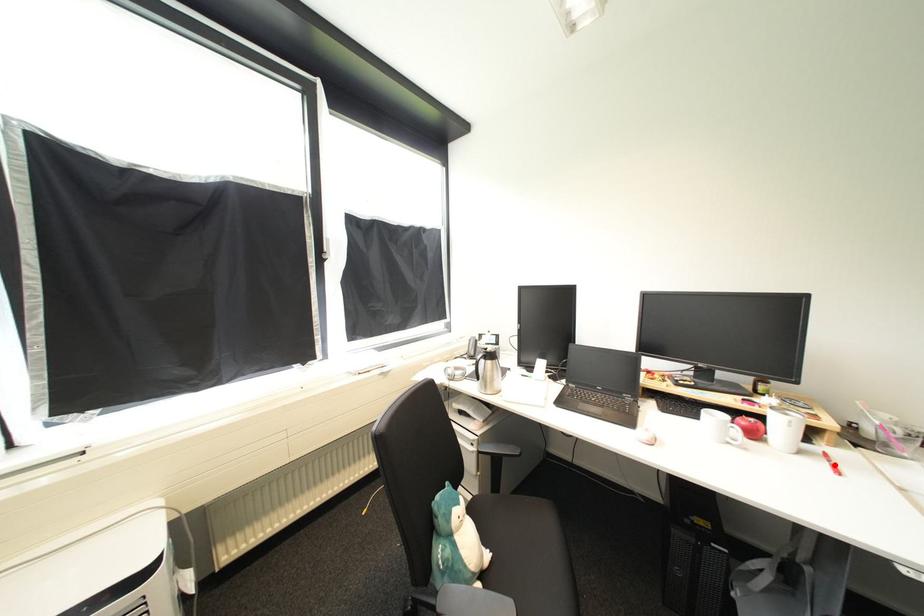
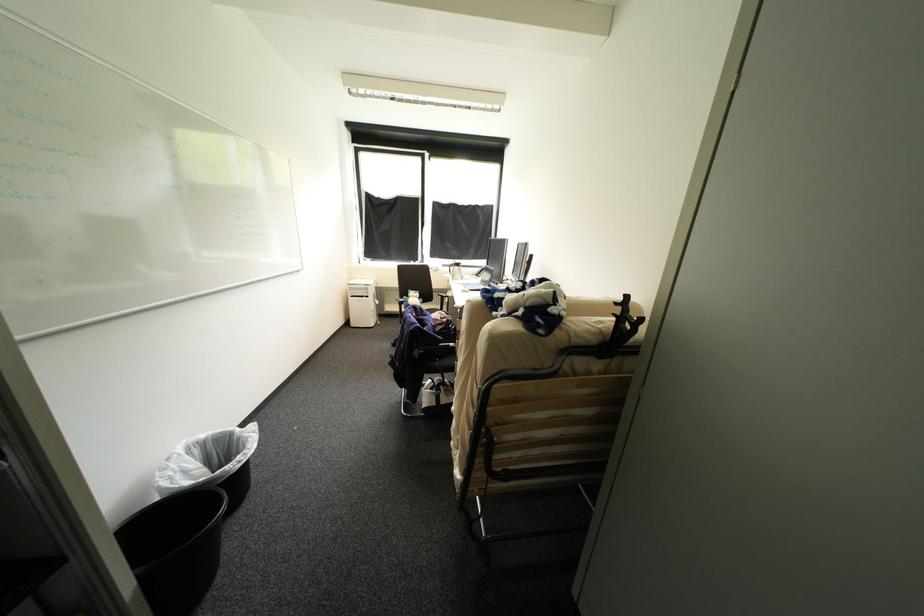
Question: I am providing you with two images of the same scene from different viewpoints. A red point is marked on the first image. At the location where the point appears in image 1, is it still visible in image 2?

Choices:
 (A) Yes
 (B) No

Answer: (B)